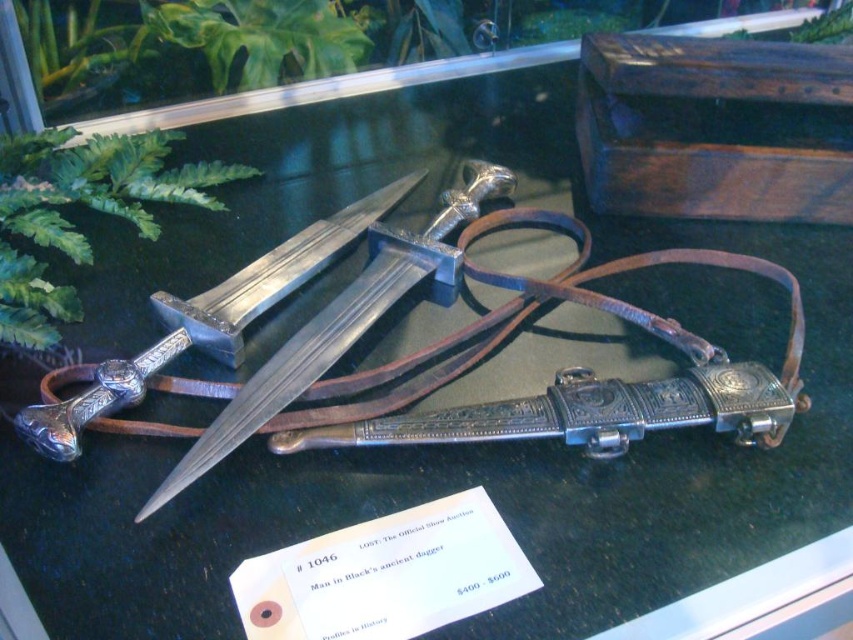
Consider the image. You are standing in front of a display case with medieval weapons. You notice two points marked on the case. The first point is at coordinates point (346, 296) and the second is at point (276, 282). Which point is closer to you?

Point (346, 296) is in front of point (276, 282), so it is closer to you.

From the picture: You are a museum visitor standing in front of the display case. You notice the polished silver sword at center and the polished silver dagger at center. Which one appears nearer to you?

The polished silver sword at center appears nearer to you because it is closer to the viewer than the polished silver dagger at center.

You are a museum security guard who needs to ensure the distance between the polished silver sword at center and the polished silver dagger at center is at least 5 inches to prevent accidental contact. Based on the scene, is the current spacing sufficient?

The polished silver sword at center and polished silver dagger at center are 4.31 inches apart from each other, which is less than the required 5 inches. Therefore, the current spacing is insufficient to prevent accidental contact.